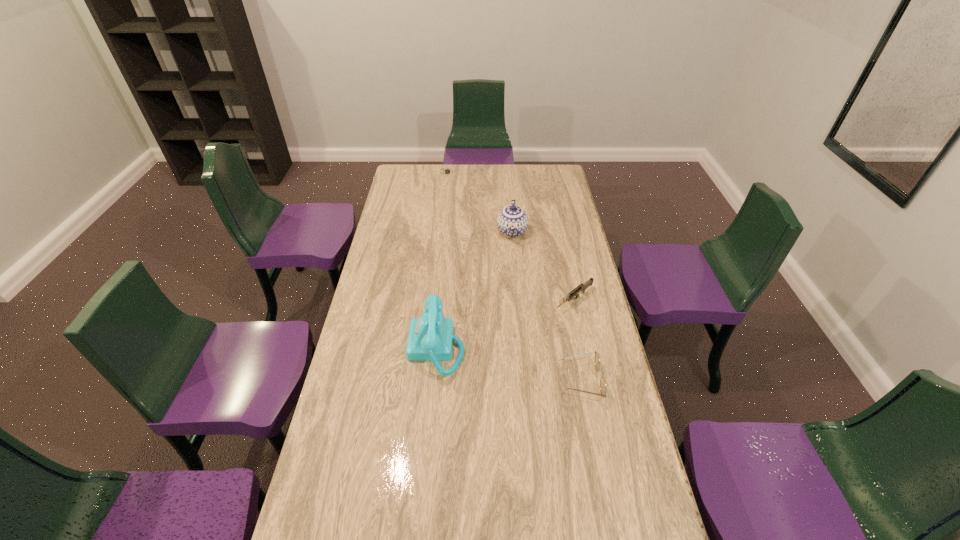
Find the location of a particular element. This screenshot has width=960, height=540. vacant space on the desktop that is between the telephone and the spectacles and is positioned aimed along the barrel of the third nearest object is located at coordinates (497, 361).

Locate an element on the screen. The image size is (960, 540). vacant space on the desktop that is between the telephone and the spectacles and is positioned on the face of the watch is located at coordinates (499, 361).

I want to click on free space on the desktop that is between the telephone and the spectacles and is positioned at the spout of the second farthest object, so click(508, 363).